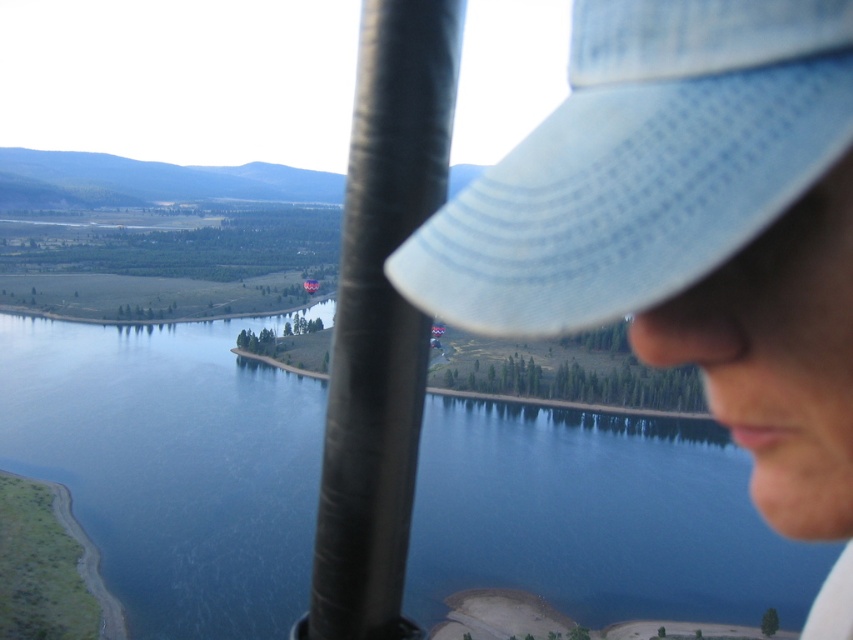
Consider the image. You are a photographer trying to capture the entire blue water at center and light blue woven baseball cap at upper right in one shot. Will both objects fit in the frame if the camera has a wide enough lens?

The blue water at center might be wider than light blue woven baseball cap at upper right, so it depends on the lens width. If the lens can capture the width of the blue water at center, then both will fit.

You are a passenger in an aircraft and you see the blue water at center and the light blue woven baseball cap at upper right. Which object is positioned lower in the image?

The blue water at center is positioned lower than the light blue woven baseball cap at upper right.